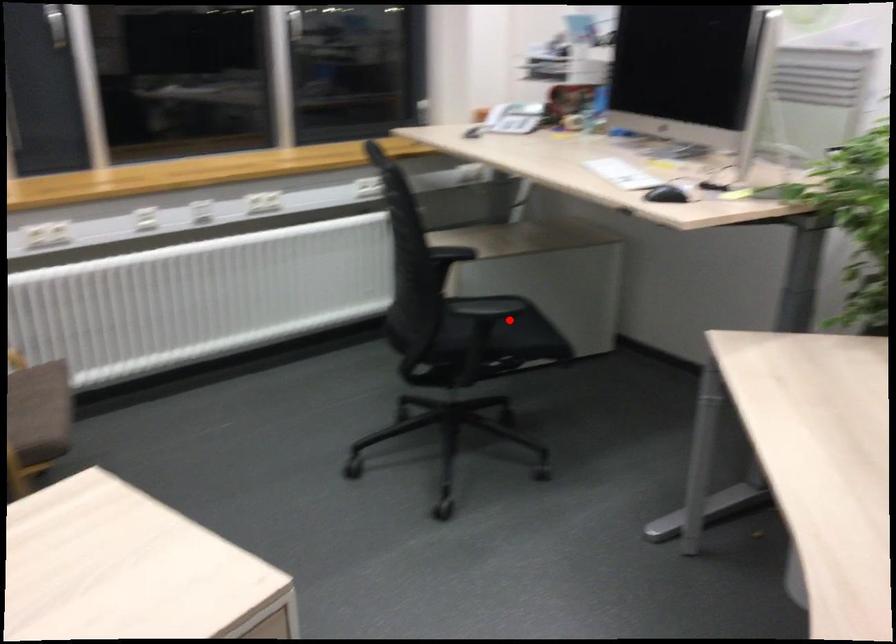
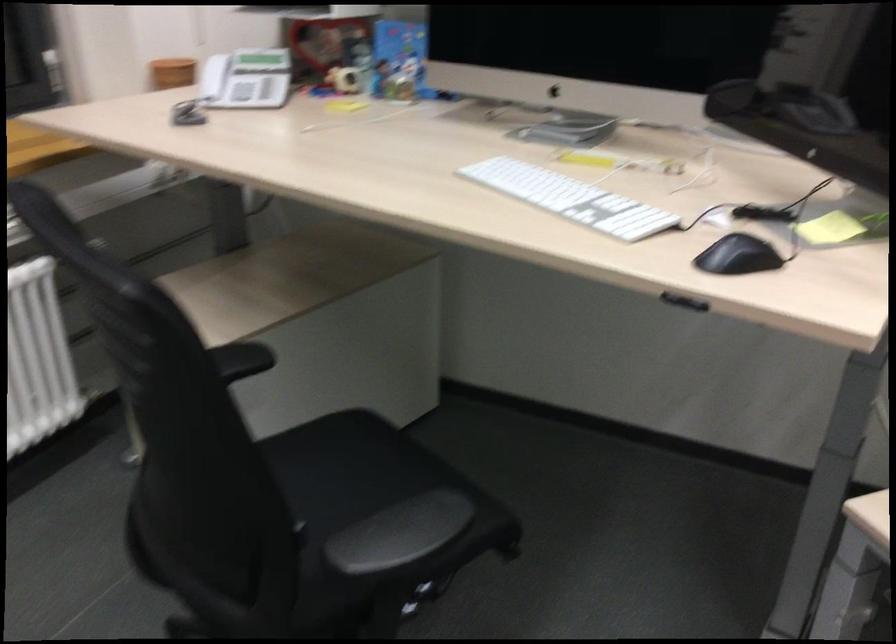
Question: A red point is marked in image1. In image2, is the corresponding 3D point closer to the camera or farther? Reply with the corresponding letter.

Choices:
 (A) The corresponding 3D point is closer.
 (B) The corresponding 3D point is farther.

Answer: (A)